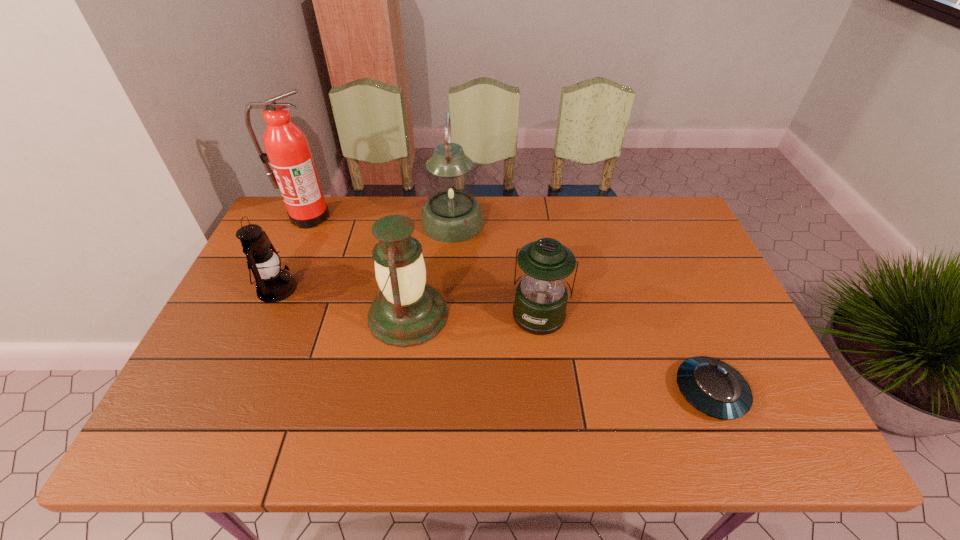
Locate an element on the screen. Image resolution: width=960 pixels, height=540 pixels. free spot that satisfies the following two spatial constraints: 1. on the label side of the fifth object from left to right; 2. on the left side of the tallest object is located at coordinates (264, 314).

The height and width of the screenshot is (540, 960). What are the coordinates of `free location that satisfies the following two spatial constraints: 1. with the light compartment facing forward on the shortest object; 2. on the right side of the third tallest object` in the screenshot? It's located at (396, 392).

Find the location of `free region that satisfies the following two spatial constraints: 1. on the side of the nearest object, there is a wick adjustment knob; 2. on the right side of the leftmost lantern`. free region that satisfies the following two spatial constraints: 1. on the side of the nearest object, there is a wick adjustment knob; 2. on the right side of the leftmost lantern is located at coordinates (231, 392).

Locate an element on the screen. This screenshot has height=540, width=960. free space that satisfies the following two spatial constraints: 1. on the back side of the second object from right to left; 2. on the side of the leftmost lantern, there is a wick adjustment knob is located at coordinates (537, 288).

The image size is (960, 540). Identify the location of vacant region that satisfies the following two spatial constraints: 1. on the label side of the fire extinguisher; 2. on the left side of the second object from right to left. (264, 314).

Where is `vacant space that satisfies the following two spatial constraints: 1. on the side of the leftmost lantern, there is a wick adjustment knob; 2. on the right side of the saucer`? This screenshot has width=960, height=540. vacant space that satisfies the following two spatial constraints: 1. on the side of the leftmost lantern, there is a wick adjustment knob; 2. on the right side of the saucer is located at coordinates pos(231,392).

The width and height of the screenshot is (960, 540). I want to click on vacant space that satisfies the following two spatial constraints: 1. on the label side of the tallest object; 2. on the left side of the fifth shortest object, so click(305, 223).